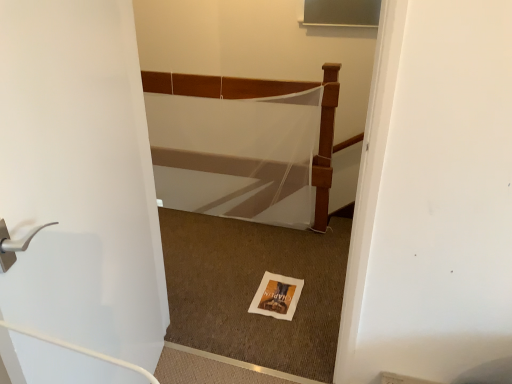
What is the approximate height of white mesh bed at center?

The height of white mesh bed at center is 1.01 meters.

The height and width of the screenshot is (384, 512). I want to click on white matte door at left, so click(x=80, y=179).

Where is `white paper postcard at center`? white paper postcard at center is located at coordinates pos(277,296).

Is point (298, 297) farther from viewer compared to point (34, 180)?

Yes.

Consider the image. From a real-world perspective, is white paper postcard at center beneath white matte door at left?

Yes, from a real-world perspective, white paper postcard at center is below white matte door at left.

Could you tell me if white paper postcard at center is facing white matte door at left?

No, white paper postcard at center is not turned towards white matte door at left.

Locate an element on the screen. door that appears above the white paper postcard at center (from a real-world perspective) is located at coordinates (80, 179).

Is white matte door at left beside white mesh bed at center?

white matte door at left is not next to white mesh bed at center, and they're not touching.

Based on their positions, is white matte door at left located to the left or right of white mesh bed at center?

white matte door at left is positioned on white mesh bed at center's left side.

From a real-world perspective, between white matte door at left and white mesh bed at center, who is vertically higher?

white matte door at left, from a real-world perspective.

Is there a large distance between white paper postcard at center and white mesh bed at center?

No, white paper postcard at center is not far away from white mesh bed at center.

Which of these two, white paper postcard at center or white mesh bed at center, is bigger?

With larger size is white mesh bed at center.

Which is in front, point (295, 302) or point (319, 203)?

The point (295, 302) is closer to the camera.

Which is in front, point (1, 96) or point (269, 274)?

The point (1, 96) is closer to the camera.

How far apart are white matte door at left and white paper postcard at center?

They are 38.13 inches apart.

In the image, is white matte door at left positioned in front of or behind white paper postcard at center?

white matte door at left is positioned closer to the viewer than white paper postcard at center.

Does white mesh bed at center appear on the left side of white paper postcard at center?

Yes, white mesh bed at center is to the left of white paper postcard at center.

Could you tell me if white mesh bed at center is turned towards white paper postcard at center?

Yes, white mesh bed at center is turned towards white paper postcard at center.

From a real-world perspective, which is physically below, white mesh bed at center or white paper postcard at center?

white paper postcard at center is physically lower.

Is point (145, 86) closer to viewer compared to point (292, 315)?

No, (145, 86) is further to viewer.

From the image's perspective, does white mesh bed at center appear lower than white matte door at left?

Incorrect, from the image's perspective, white mesh bed at center is higher than white matte door at left.

Is white mesh bed at center touching white matte door at left?

No, white mesh bed at center is not beside white matte door at left.

From a real-world perspective, is white mesh bed at center over white matte door at left?

Actually, white mesh bed at center is physically below white matte door at left in the real world.

This screenshot has width=512, height=384. I want to click on door located on the left of white mesh bed at center, so click(x=80, y=179).

Find the location of a particular element. door located above the white paper postcard at center (from the image's perspective) is located at coordinates (80, 179).

Find the location of a particular element. The height and width of the screenshot is (384, 512). bed that appears below the white matte door at left (from a real-world perspective) is located at coordinates (266, 95).

Looking at the image, which one is located closer to white mesh bed at center, white paper postcard at center or white matte door at left?

white paper postcard at center is closer to white mesh bed at center.

When comparing their distances from white matte door at left, does white paper postcard at center or white mesh bed at center seem closer?

white paper postcard at center is positioned closer to the anchor white matte door at left.

Looking at the image, which one is located closer to white paper postcard at center, white mesh bed at center or white matte door at left?

Among the two, white mesh bed at center is located nearer to white paper postcard at center.

From the image, which object appears to be nearer to white matte door at left, white mesh bed at center or white paper postcard at center?

Among the two, white paper postcard at center is located nearer to white matte door at left.

Estimate the real-world distances between objects in this image. Which object is closer to white paper postcard at center, white matte door at left or white mesh bed at center?

Among the two, white mesh bed at center is located nearer to white paper postcard at center.

Estimate the real-world distances between objects in this image. Which object is further from white mesh bed at center, white matte door at left or white paper postcard at center?

white matte door at left.

Identify the location of postcard located between white matte door at left and white mesh bed at center in the depth direction. (277, 296).